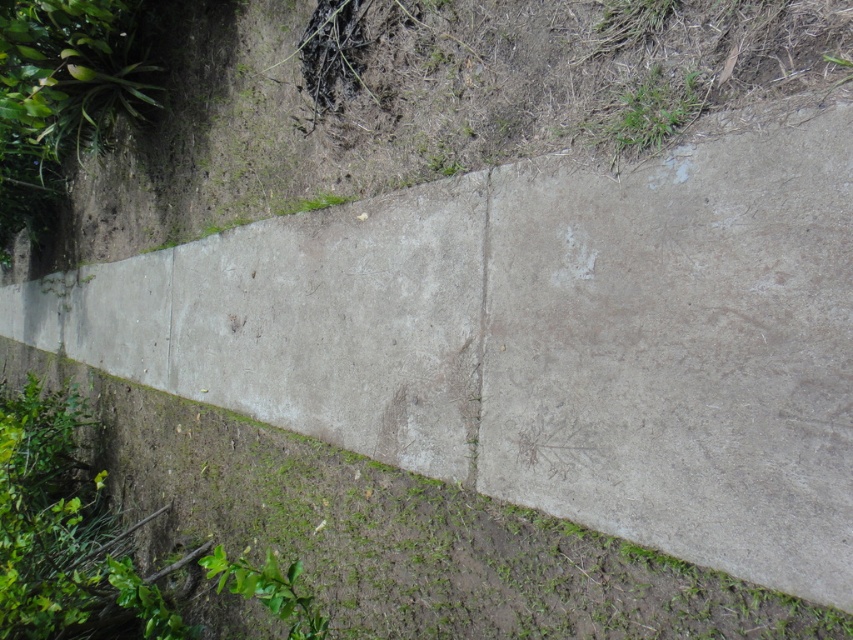
Question: Which of the following is the farthest from the observer?

Choices:
 (A) (776, 1)
 (B) (619, 120)

Answer: (B)

Question: Is rough concrete at upper left wider than gray concrete crack at center?

Choices:
 (A) no
 (B) yes

Answer: (B)

Question: Is green grass at upper right to the right of green leafy plant at lower left from the viewer's perspective?

Choices:
 (A) yes
 (B) no

Answer: (A)

Question: Which point is closer to the camera?

Choices:
 (A) (315, 625)
 (B) (479, 426)

Answer: (A)

Question: Can you confirm if rough concrete at upper left is thinner than green grass at upper right?

Choices:
 (A) yes
 (B) no

Answer: (B)

Question: Which point is farther to the camera?

Choices:
 (A) green leafy plant at lower left
 (B) rough concrete at upper left

Answer: (A)